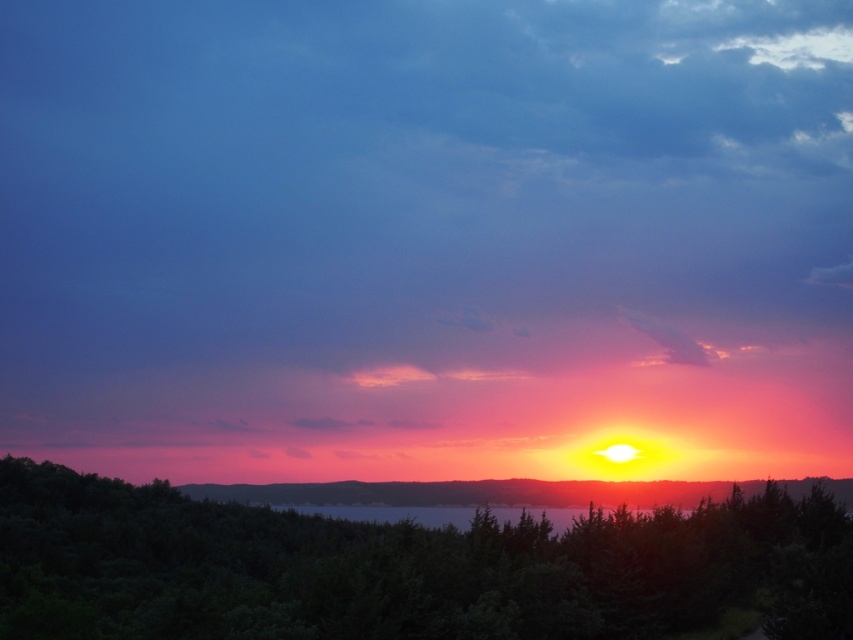
From the picture: Can you confirm if green leafy tree at center is positioned to the right of smooth orange sky at center?

Incorrect, green leafy tree at center is not on the right side of smooth orange sky at center.

Does green leafy tree at center have a smaller size compared to smooth orange sky at center?

Yes.

Measure the distance between green leafy tree at center and camera.

green leafy tree at center is 14.00 meters away from camera.

The image size is (853, 640). I want to click on green leafy tree at center, so click(405, 568).

Can you confirm if smooth orange sky at center is positioned above translucent glass water at center?

Actually, smooth orange sky at center is below translucent glass water at center.

Who is shorter, smooth orange sky at center or translucent glass water at center?

translucent glass water at center is shorter.

Where is `smooth orange sky at center`? smooth orange sky at center is located at coordinates (479, 492).

At what (x,y) coordinates should I click in order to perform the action: click on smooth orange sky at center. Please return your answer as a coordinate pair (x, y). The image size is (853, 640). Looking at the image, I should click on (479, 492).

How far apart are green leafy tree at center and translucent glass water at center?

green leafy tree at center is 112.82 feet from translucent glass water at center.

The height and width of the screenshot is (640, 853). I want to click on green leafy tree at center, so click(405, 568).

Locate an element on the screen. This screenshot has height=640, width=853. green leafy tree at center is located at coordinates (405, 568).